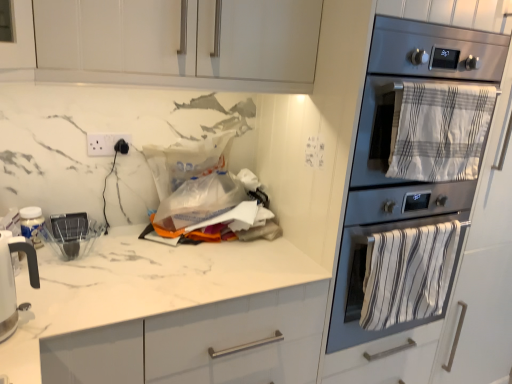
The width and height of the screenshot is (512, 384). Identify the location of free space above white marble countertop at center (from a real-world perspective). (135, 262).